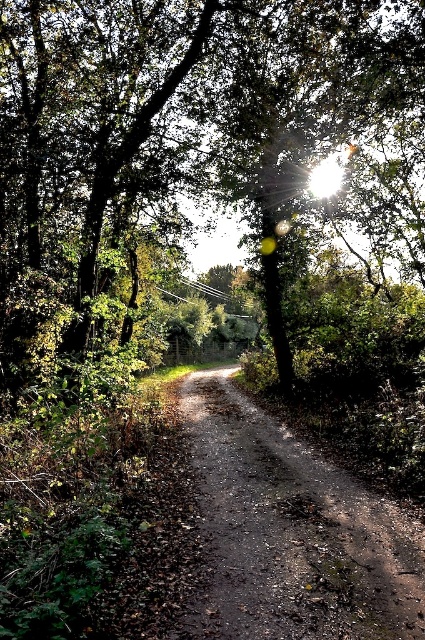
Which is more to the left, green leafy tree at center or dusty brown dirt track at center?

dusty brown dirt track at center

Can you confirm if green leafy tree at center is positioned to the right of dusty brown dirt track at center?

Indeed, green leafy tree at center is positioned on the right side of dusty brown dirt track at center.

Where is `green leafy tree at center`? The image size is (425, 640). green leafy tree at center is located at coordinates (195, 152).

At what (x,y) coordinates should I click in order to perform the action: click on green leafy tree at center. Please return your answer as a coordinate pair (x, y). Image resolution: width=425 pixels, height=640 pixels. Looking at the image, I should click on (195, 152).